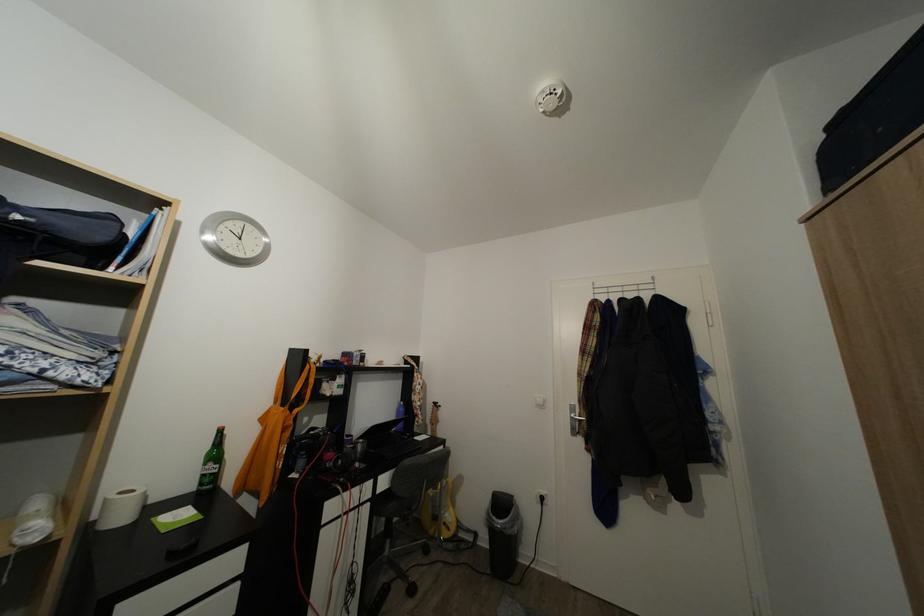
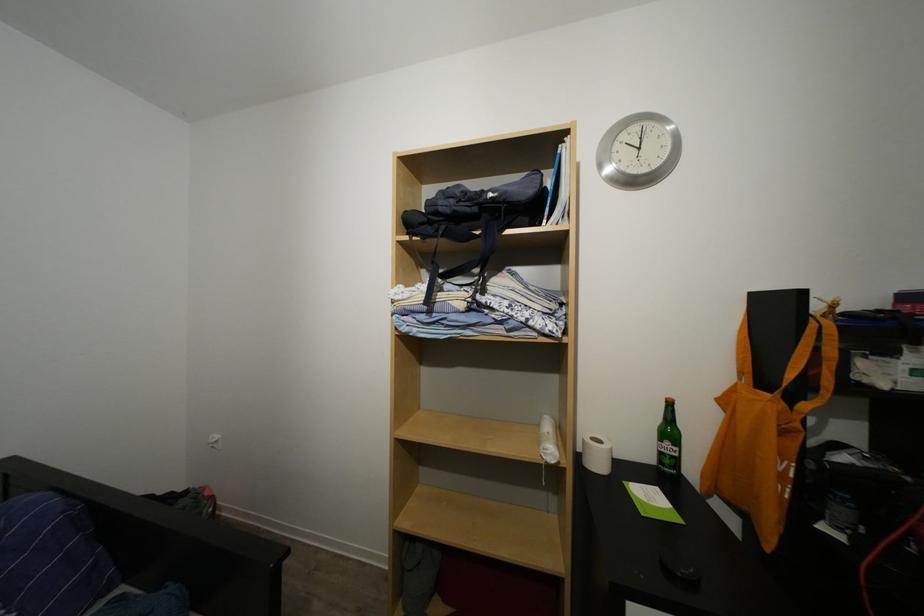
Where in the second image is the point corresponding to [129,500] from the first image?

(601, 446)